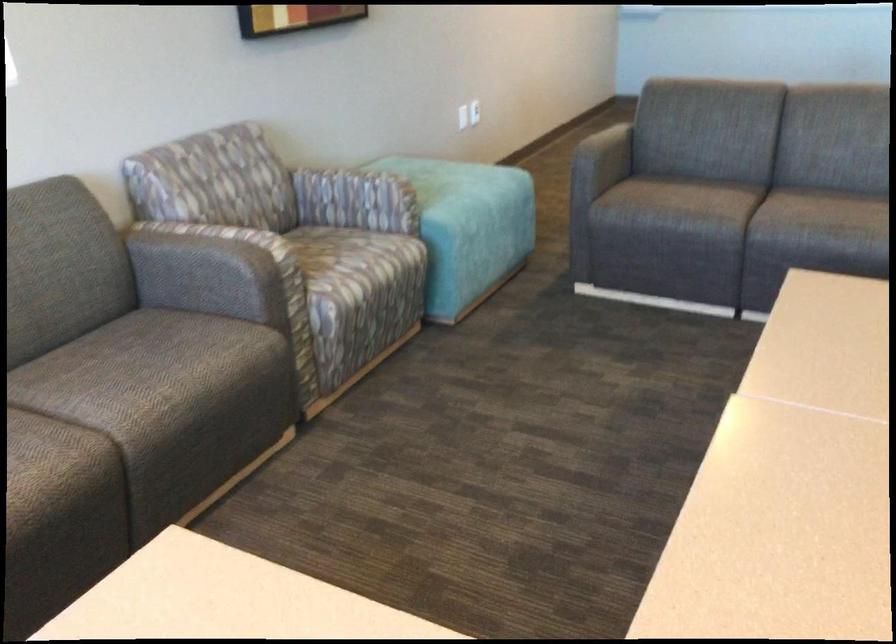
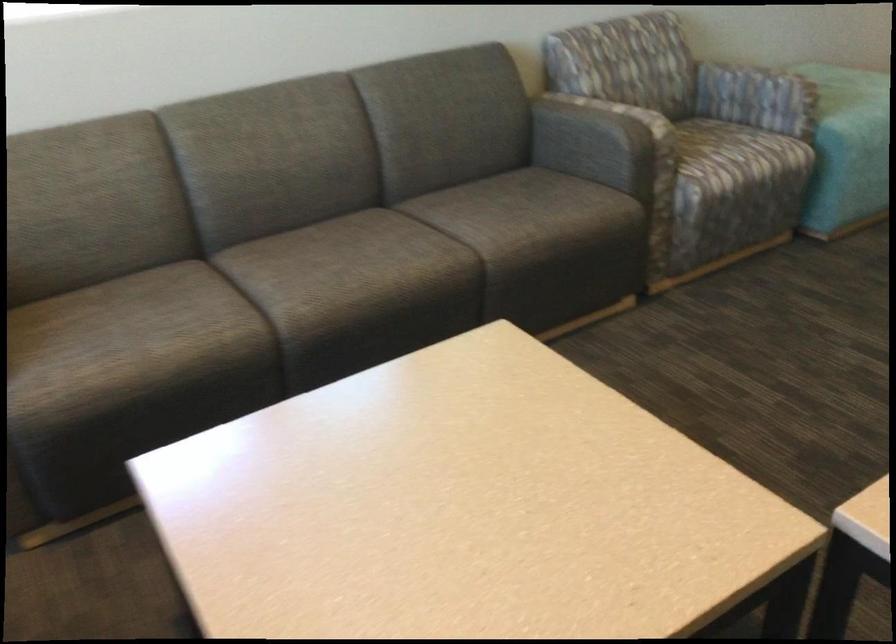
Find the pixel in the second image that matches the point at 330,193 in the first image.

(728, 84)